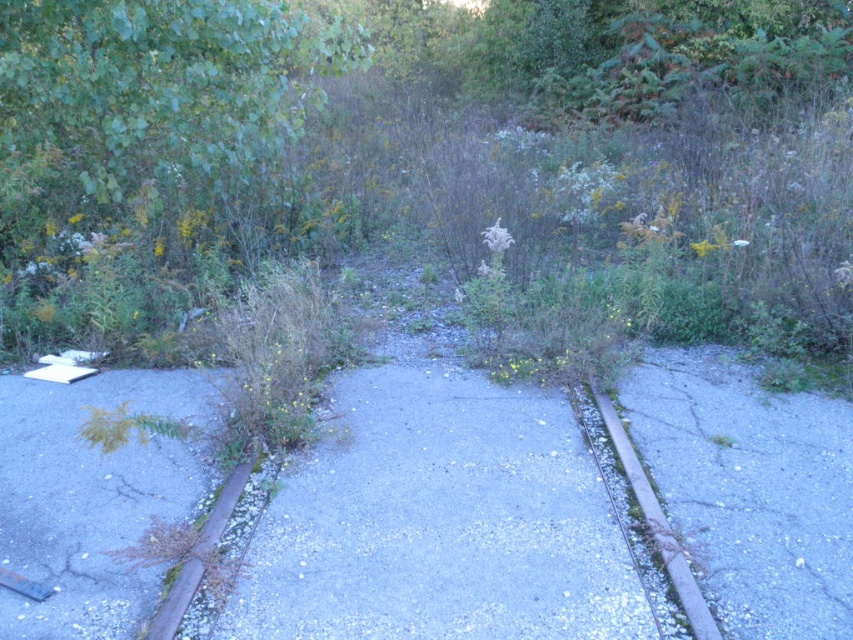
Can you confirm if gray concrete pavement at center is wider than rusty metal curb at lower right?

Correct, the width of gray concrete pavement at center exceeds that of rusty metal curb at lower right.

The image size is (853, 640). I want to click on gray concrete pavement at center, so click(439, 522).